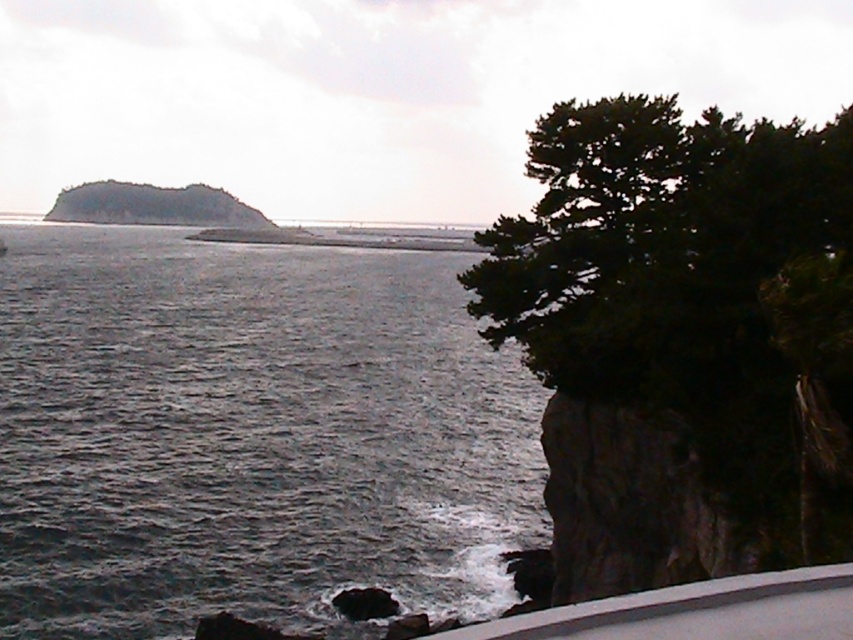
You are a photographer planning to capture the dark green leafy tree at right and the dark gray rocky island at upper left in a single frame. Based on their sizes in the image, which object would appear smaller in the final photo?

The dark green leafy tree at right appears smaller in the final photo because it occupies less space than the dark gray rocky island at upper left.